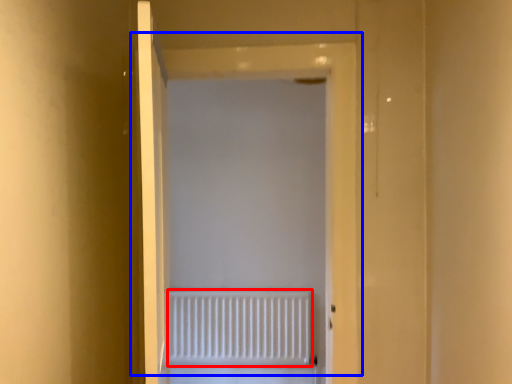
Question: Which of the following is the closest to the observer, radiator (highlighted by a red box) or door (highlighted by a blue box)?

Choices:
 (A) radiator
 (B) door

Answer: (B)